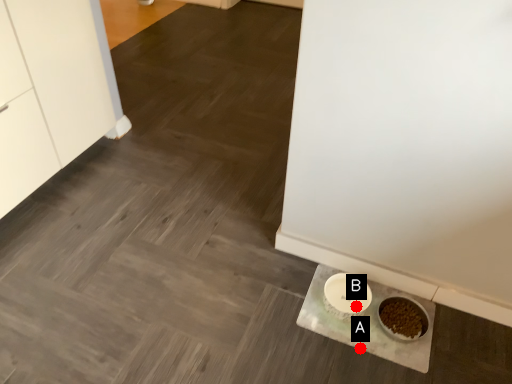
Question: Two points are circled on the image, labeled by A and B beside each circle. Which point is closer to the camera?

Choices:
 (A) A is closer
 (B) B is closer

Answer: (A)